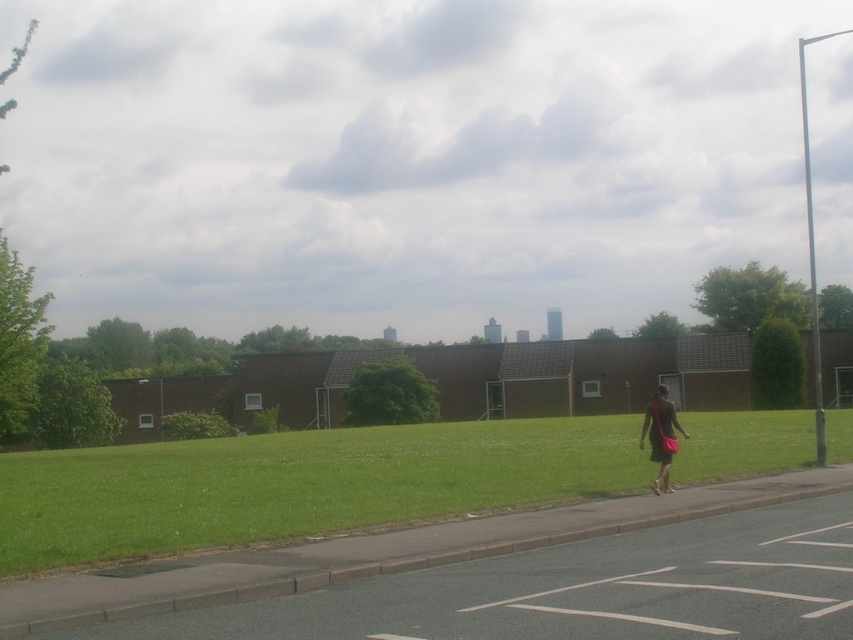
You are standing at the camera position and see two points in the scene. Which point, point (x=537, y=474) or point (x=643, y=429), is closer to you?

Point (x=537, y=474) is closer to you because it is further to the camera than point (x=643, y=429).